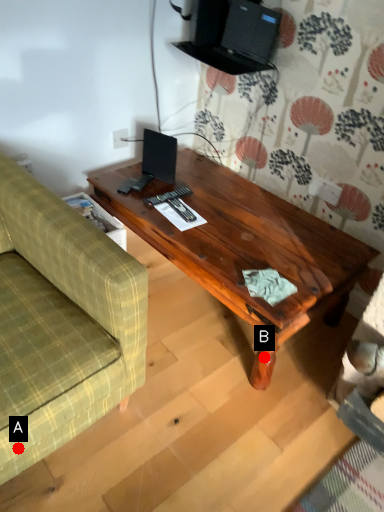
Question: Two points are circled on the image, labeled by A and B beside each circle. Which point is farther from the camera taking this photo?

Choices:
 (A) A is further
 (B) B is further

Answer: (B)